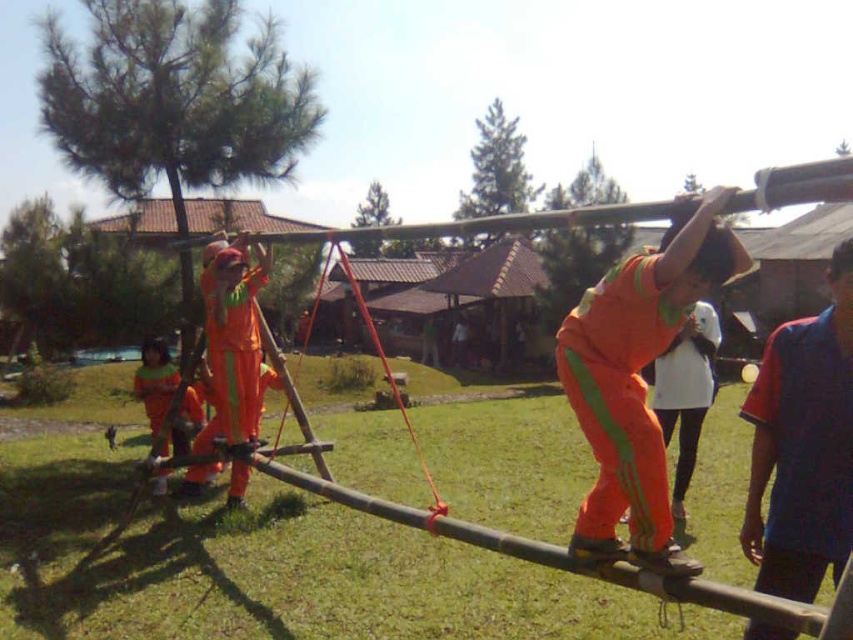
Can you confirm if orange fabric pants at center is taller than blue/red polo shirt at upper right?

Incorrect, orange fabric pants at center's height is not larger of blue/red polo shirt at upper right's.

Which is below, orange fabric pants at center or blue/red polo shirt at upper right?

blue/red polo shirt at upper right

Who is more distant from viewer, (x=738, y=246) or (x=779, y=380)?

The point (x=779, y=380) is behind.

Locate an element on the screen. The height and width of the screenshot is (640, 853). orange fabric pants at center is located at coordinates (637, 381).